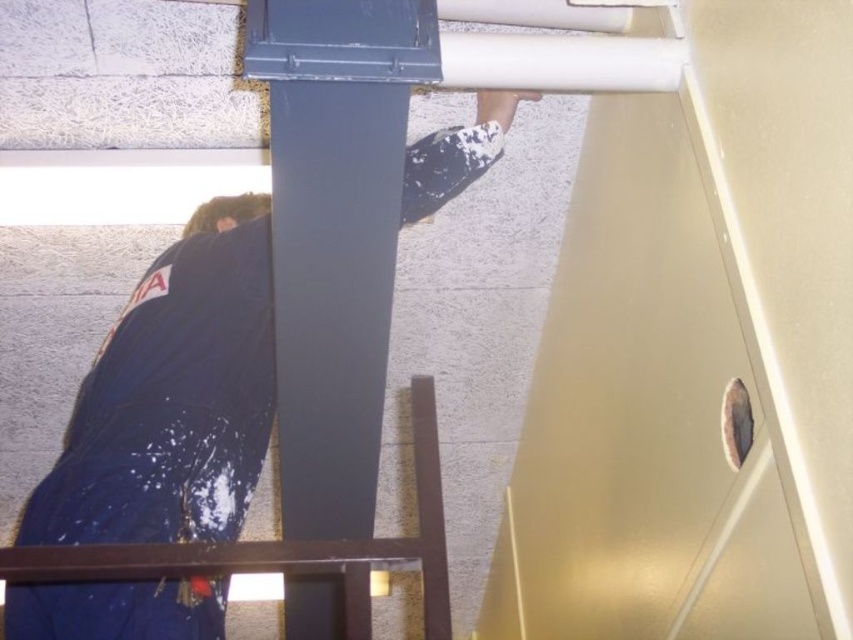
Between point (167, 492) and point (360, 198), which one is positioned in front?

Point (360, 198) is in front.

Between dark blue fabric at center and matte gray column at center, which one appears on the right side from the viewer's perspective?

From the viewer's perspective, matte gray column at center appears more on the right side.

The height and width of the screenshot is (640, 853). What do you see at coordinates (171, 404) in the screenshot? I see `dark blue fabric at center` at bounding box center [171, 404].

The height and width of the screenshot is (640, 853). I want to click on dark blue fabric at center, so click(x=171, y=404).